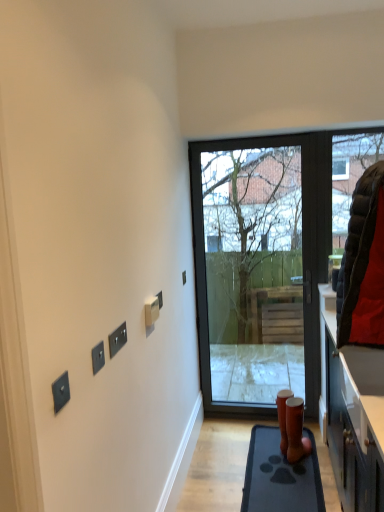
Question: In terms of width, does rubber mat at lower right look wider or thinner when compared to black matte switch at upper center, which is the third electric outlet from front to back?

Choices:
 (A) wide
 (B) thin

Answer: (A)

Question: Relative to black matte switch at upper center, the third electric outlet in the back-to-front sequence, is rubber mat at lower right in front or behind?

Choices:
 (A) behind
 (B) front

Answer: (A)

Question: Considering the real-world distances, which object is closest to the black matte switch at upper center, the 3th electric outlet viewed from the left?

Choices:
 (A) brown matte vase at lower center
 (B) matte black door at center
 (C) white plastic electric outlet at center, the fourth electric outlet positioned from the front
 (D) satin black switch at lower left, marked as the 5th electric outlet in a back-to-front arrangement
 (E) satin black switch at upper left, the 4th electric outlet from the back

Answer: (E)

Question: Which is farther from the white plastic electric outlet at center, the fourth electric outlet positioned from the front?

Choices:
 (A) black quilted jacket at right
 (B) black matte switch at upper center, which is the third electric outlet from front to back
 (C) brown matte vase at lower center
 (D) satin black switch at upper left, the 2th electric outlet in the left-to-right sequence
 (E) satin black switch at lower left, the fifth electric outlet positioned from the right

Answer: (C)